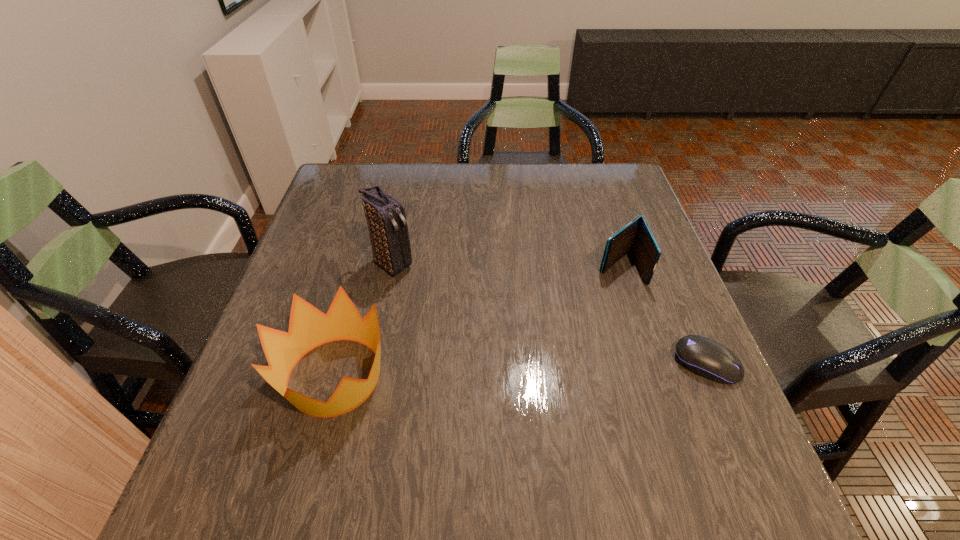
Identify the location of vacant region located 0.350m on the exterior surface of the wallet. (499, 362).

Locate an element on the screen. This screenshot has width=960, height=540. vacant space located 0.360m on the exterior surface of the wallet is located at coordinates (495, 364).

Identify the location of object that is at the near edge. (309, 328).

Where is `object present at the left edge`? Image resolution: width=960 pixels, height=540 pixels. object present at the left edge is located at coordinates (309, 328).

Locate an element on the screen. computer mouse present at the right edge is located at coordinates (705, 357).

Where is `wallet at the right edge`? This screenshot has height=540, width=960. wallet at the right edge is located at coordinates (637, 237).

Locate an element on the screen. The image size is (960, 540). object at the near left corner is located at coordinates (309, 328).

The height and width of the screenshot is (540, 960). I want to click on vacant space at the far edge of the desktop, so click(472, 174).

The width and height of the screenshot is (960, 540). In order to click on vacant space at the near edge of the desktop in this screenshot , I will do 583,412.

Locate an element on the screen. free location at the left edge of the desktop is located at coordinates (356, 230).